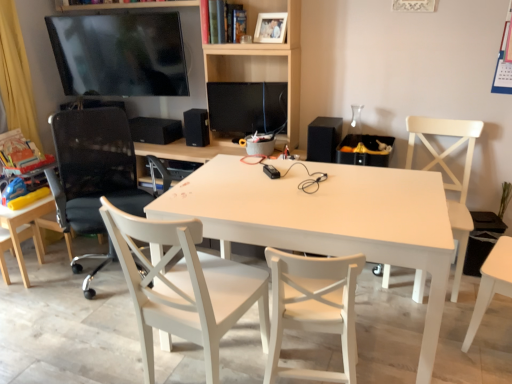
Question: Can you confirm if matte black monitor at center is shorter than black mesh office chair at left, marked as the 2th chair in a left-to-right arrangement?

Choices:
 (A) no
 (B) yes

Answer: (B)

Question: From a real-world perspective, is matte black monitor at center beneath black mesh office chair at left, marked as the 2th chair in a left-to-right arrangement?

Choices:
 (A) no
 (B) yes

Answer: (A)

Question: Can we say matte black monitor at center lies outside black mesh office chair at left, marked as the 4th chair in a right-to-left arrangement?

Choices:
 (A) yes
 (B) no

Answer: (A)

Question: Is the depth of matte black monitor at center greater than that of black mesh office chair at left, marked as the 2th chair in a left-to-right arrangement?

Choices:
 (A) no
 (B) yes

Answer: (B)

Question: Could black mesh office chair at left, marked as the 4th chair in a right-to-left arrangement, be considered to be inside matte black monitor at center?

Choices:
 (A) yes
 (B) no

Answer: (B)

Question: Is white wood chair at center, the third chair from the left, in front of or behind white matte picture frame at upper center in the image?

Choices:
 (A) front
 (B) behind

Answer: (A)

Question: Considering the relative positions of white wood chair at center, the third chair from the left, and white matte picture frame at upper center in the image provided, is white wood chair at center, the third chair from the left, to the left or to the right of white matte picture frame at upper center?

Choices:
 (A) left
 (B) right

Answer: (A)

Question: Looking at the image, does white wood chair at center, the third chair from the left, seem bigger or smaller compared to white matte picture frame at upper center?

Choices:
 (A) small
 (B) big

Answer: (B)

Question: Considering the positions of white wood chair at center, the 3th chair positioned from the right, and white matte picture frame at upper center in the image, is white wood chair at center, the 3th chair positioned from the right, wider or thinner than white matte picture frame at upper center?

Choices:
 (A) thin
 (B) wide

Answer: (B)

Question: Is point (237, 208) closer or farther from the camera than point (236, 134)?

Choices:
 (A) farther
 (B) closer

Answer: (B)

Question: Would you say white matte table at center is to the left or to the right of matte black monitor at center in the picture?

Choices:
 (A) left
 (B) right

Answer: (B)

Question: From the image's perspective, is white matte table at center positioned above or below matte black monitor at center?

Choices:
 (A) below
 (B) above

Answer: (A)

Question: In terms of width, does white matte table at center look wider or thinner when compared to matte black monitor at center?

Choices:
 (A) wide
 (B) thin

Answer: (A)

Question: Is black matte speaker at right, the 1th speaker positioned from the right, to the left or to the right of black mesh office chair at left, marked as the 4th chair in a right-to-left arrangement, in the image?

Choices:
 (A) left
 (B) right

Answer: (B)

Question: In terms of width, does black matte speaker at right, the 3th speaker viewed from the back, look wider or thinner when compared to black mesh office chair at left, marked as the 2th chair in a left-to-right arrangement?

Choices:
 (A) wide
 (B) thin

Answer: (B)